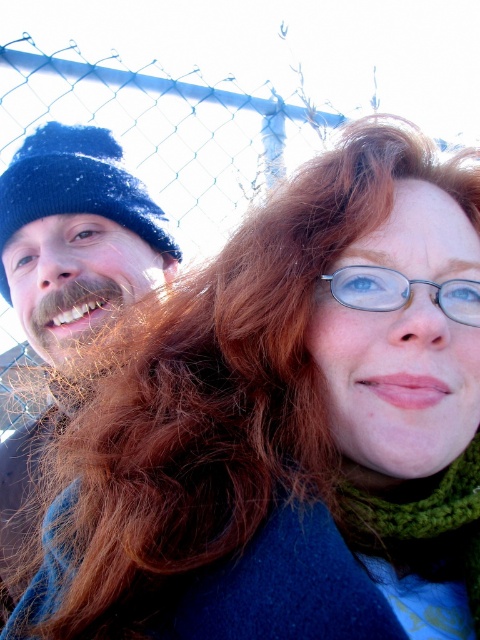
Between dark blue knit hat at left and metallic silver glasses at upper center, which one has less height?

metallic silver glasses at upper center

In the scene shown: Can you confirm if dark blue knit hat at left is positioned below metallic silver glasses at upper center?

Correct, dark blue knit hat at left is located below metallic silver glasses at upper center.

Identify the location of dark blue knit hat at left. (75, 236).

Measure the distance between point [23,214] and camera.

The distance of point [23,214] from camera is 1.39 meters.

Where is `dark blue knit hat at left`? dark blue knit hat at left is located at coordinates (75, 236).

Identify the location of dark blue knit hat at left. (75, 236).

Can you confirm if green knitted scarf at lower right is positioned below metallic silver glasses at upper center?

Yes, green knitted scarf at lower right is below metallic silver glasses at upper center.

Is point (459, 488) positioned before point (469, 310)?

No, it is behind (469, 310).

This screenshot has width=480, height=640. I want to click on green knitted scarf at lower right, so click(421, 524).